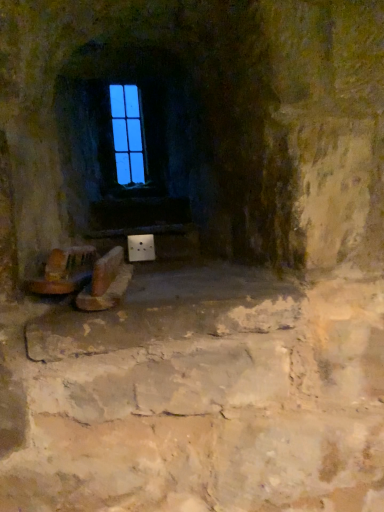
Question: Does wooden chair at lower left touch brown leather shoes at lower center?

Choices:
 (A) no
 (B) yes

Answer: (B)

Question: From a real-world perspective, is wooden chair at lower left physically below brown leather shoes at lower center?

Choices:
 (A) no
 (B) yes

Answer: (A)

Question: Could you tell me if wooden chair at lower left is facing brown leather shoes at lower center?

Choices:
 (A) no
 (B) yes

Answer: (A)

Question: Considering the relative sizes of wooden chair at lower left and brown leather shoes at lower center in the image provided, is wooden chair at lower left taller than brown leather shoes at lower center?

Choices:
 (A) no
 (B) yes

Answer: (A)

Question: Does wooden chair at lower left have a greater width compared to brown leather shoes at lower center?

Choices:
 (A) no
 (B) yes

Answer: (A)

Question: Can you confirm if wooden chair at lower left is smaller than brown leather shoes at lower center?

Choices:
 (A) no
 (B) yes

Answer: (B)

Question: Considering the relative sizes of blue glass window at upper center and brown leather shoes at lower center in the image provided, is blue glass window at upper center shorter than brown leather shoes at lower center?

Choices:
 (A) no
 (B) yes

Answer: (A)

Question: Is blue glass window at upper center smaller than brown leather shoes at lower center?

Choices:
 (A) no
 (B) yes

Answer: (B)

Question: Is blue glass window at upper center placed right next to brown leather shoes at lower center?

Choices:
 (A) no
 (B) yes

Answer: (A)

Question: Considering the relative positions of blue glass window at upper center and brown leather shoes at lower center in the image provided, is blue glass window at upper center in front of brown leather shoes at lower center?

Choices:
 (A) no
 (B) yes

Answer: (A)

Question: From a real-world perspective, is blue glass window at upper center physically above brown leather shoes at lower center?

Choices:
 (A) yes
 (B) no

Answer: (A)

Question: Can you confirm if blue glass window at upper center is thinner than brown leather shoes at lower center?

Choices:
 (A) no
 (B) yes

Answer: (B)

Question: From the image's perspective, is blue glass window at upper center on top of wooden chair at lower left?

Choices:
 (A) no
 (B) yes

Answer: (B)